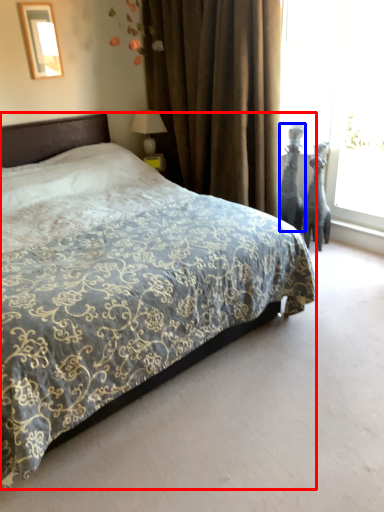
Question: Which of the following is the closest to the observer, bed (highlighted by a red box) or sculpture (highlighted by a blue box)?

Choices:
 (A) bed
 (B) sculpture

Answer: (A)